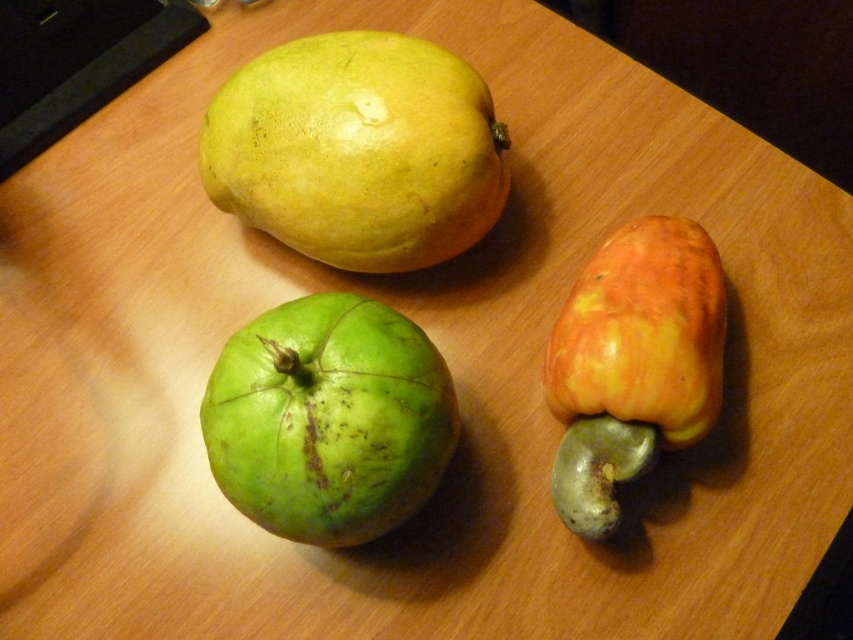
Consider the image. You are organizing fruits on a shelf and need to know their sizes. Which fruit is larger between the yellow matte mango at upper left and the green matte apple at center?

The yellow matte mango at upper left is bigger than the green matte apple at center, so the yellow matte mango at upper left is larger.